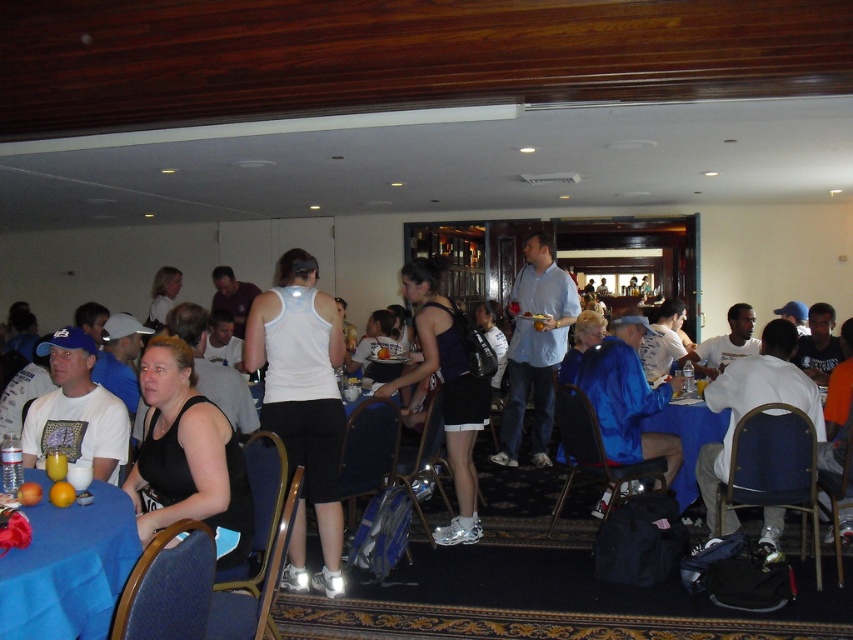
Question: Does black fabric tank top at center appear under blue fabric table at lower left?

Choices:
 (A) no
 (B) yes

Answer: (A)

Question: Is white cotton shirt at center in front of matte white t-shirt at left?

Choices:
 (A) no
 (B) yes

Answer: (A)

Question: Which point is farther from the camera taking this photo?

Choices:
 (A) (519, 429)
 (B) (688, 451)
 (C) (41, 440)

Answer: (A)

Question: Which point is farther from the camera taking this photo?

Choices:
 (A) click(x=97, y=566)
 (B) click(x=70, y=451)
 (C) click(x=265, y=292)
 (D) click(x=734, y=362)

Answer: (D)

Question: Which object is farther from the camera taking this photo?

Choices:
 (A) blue fabric table at lower left
 (B) white fabric shirt at right
 (C) matte white t-shirt at left

Answer: (B)

Question: Does black fabric tank top at center have a smaller size compared to matte white t-shirt at left?

Choices:
 (A) no
 (B) yes

Answer: (B)